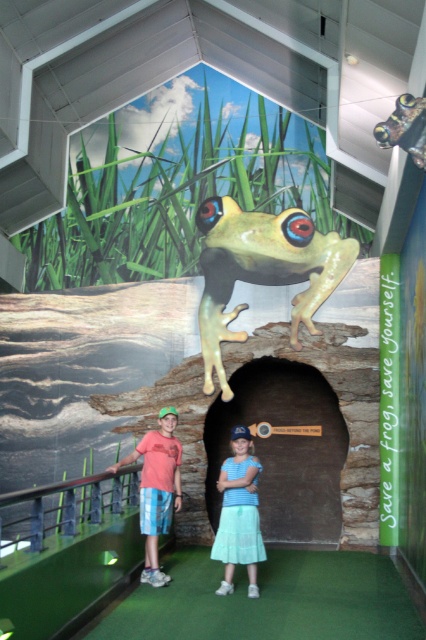
Question: Can you confirm if green rubber frog at center is bigger than matte coral t-shirt at center?

Choices:
 (A) no
 (B) yes

Answer: (B)

Question: Which of the following is the farthest from the observer?

Choices:
 (A) matte coral t-shirt at center
 (B) green rubber frog at center
 (C) light blue fabric skirt at center

Answer: (B)

Question: Estimate the real-world distances between objects in this image. Which object is farther from the light blue fabric skirt at center?

Choices:
 (A) green rubber frog at center
 (B) matte coral t-shirt at center

Answer: (A)

Question: Is green rubber frog at center wider than light blue fabric skirt at center?

Choices:
 (A) yes
 (B) no

Answer: (A)

Question: Estimate the real-world distances between objects in this image. Which object is closer to the light blue fabric skirt at center?

Choices:
 (A) green rubber frog at center
 (B) matte coral t-shirt at center

Answer: (B)

Question: Can you confirm if green rubber frog at center is positioned above light blue fabric skirt at center?

Choices:
 (A) no
 (B) yes

Answer: (B)